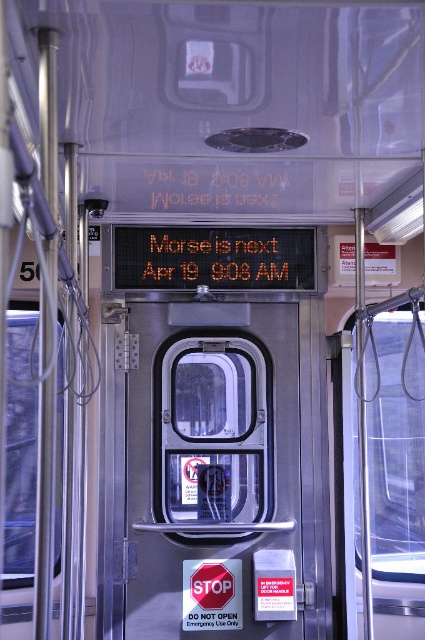
Question: Does transparent glass door at center have a larger size compared to translucent plastic text at center?

Choices:
 (A) yes
 (B) no

Answer: (A)

Question: Based on their relative distances, which object is farther from the transparent glass door at center?

Choices:
 (A) orange digital text at center
 (B) translucent plastic text at center

Answer: (B)

Question: Can you confirm if transparent glass door at center is positioned below translucent plastic text at center?

Choices:
 (A) no
 (B) yes

Answer: (B)

Question: Which object is farther from the camera taking this photo?

Choices:
 (A) orange digital text at center
 (B) transparent glass door at center

Answer: (A)

Question: Which of the following is the closest to the observer?

Choices:
 (A) (184, 262)
 (B) (161, 179)
 (C) (288, 467)

Answer: (B)

Question: Does orange digital text at center appear on the left side of translucent plastic text at center?

Choices:
 (A) no
 (B) yes

Answer: (B)